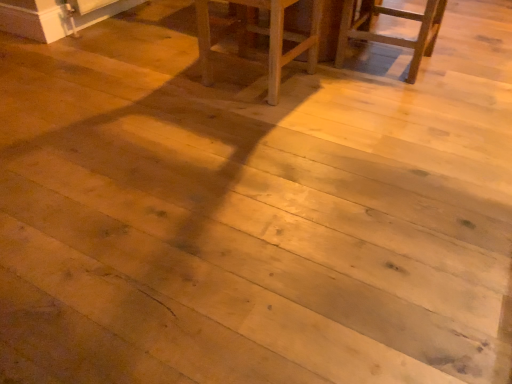
Question: From a real-world perspective, is wooden chair at upper right over wooden chair at center?

Choices:
 (A) no
 (B) yes

Answer: (A)

Question: Is wooden chair at upper right at the left side of wooden chair at center?

Choices:
 (A) yes
 (B) no

Answer: (B)

Question: Could wooden chair at center be considered to be inside wooden chair at upper right?

Choices:
 (A) no
 (B) yes

Answer: (A)

Question: Is wooden chair at upper right thinner than wooden chair at center?

Choices:
 (A) yes
 (B) no

Answer: (B)

Question: Is wooden chair at upper right not near wooden chair at center?

Choices:
 (A) no
 (B) yes

Answer: (A)

Question: Is wooden chair at upper right wider than wooden chair at center?

Choices:
 (A) no
 (B) yes

Answer: (B)

Question: From a real-world perspective, is wooden chair at center physically above wooden chair at upper right?

Choices:
 (A) yes
 (B) no

Answer: (A)

Question: From the image's perspective, would you say wooden chair at center is positioned over wooden chair at upper right?

Choices:
 (A) yes
 (B) no

Answer: (B)

Question: Can you confirm if wooden chair at center is thinner than wooden chair at upper right?

Choices:
 (A) yes
 (B) no

Answer: (A)

Question: Is wooden chair at center outside wooden chair at upper right?

Choices:
 (A) yes
 (B) no

Answer: (A)

Question: Does wooden chair at center touch wooden chair at upper right?

Choices:
 (A) yes
 (B) no

Answer: (B)

Question: Considering the relative positions of wooden chair at center and wooden chair at upper right in the image provided, is wooden chair at center to the right of wooden chair at upper right from the viewer's perspective?

Choices:
 (A) yes
 (B) no

Answer: (B)

Question: From the image's perspective, is wooden chair at upper right located above or below wooden chair at center?

Choices:
 (A) below
 (B) above

Answer: (B)